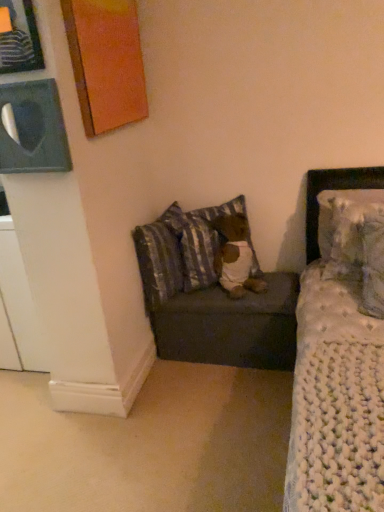
Where is `free point below brown plush bear at center (from a real-world perspective)`? free point below brown plush bear at center (from a real-world perspective) is located at coordinates (243, 290).